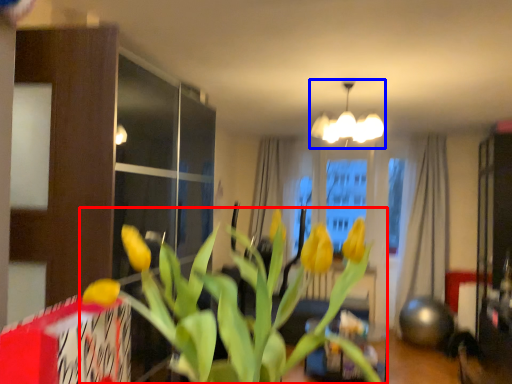
Question: Among these objects, which one is nearest to the camera, houseplant (highlighted by a red box) or lamp (highlighted by a blue box)?

Choices:
 (A) houseplant
 (B) lamp

Answer: (A)